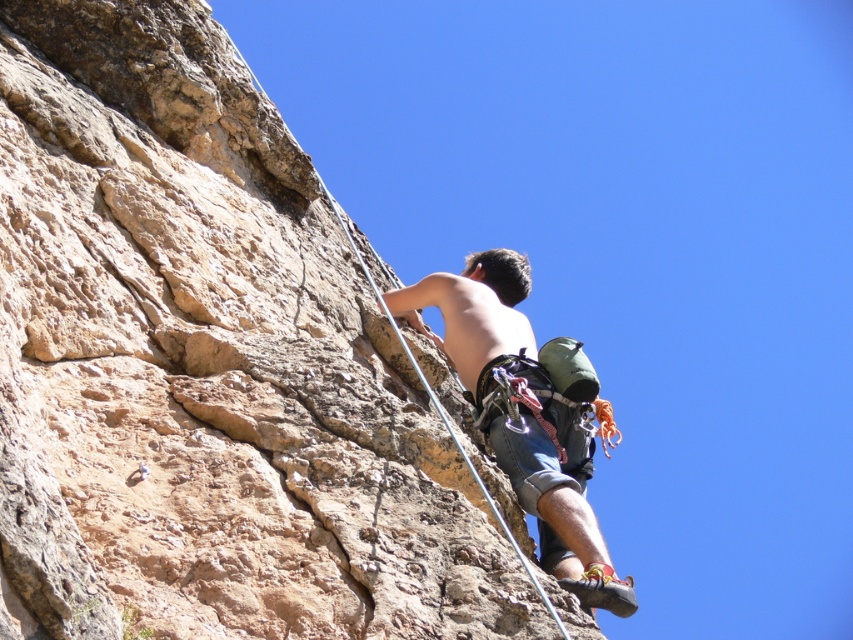
Question: Does brown rough rock at center have a larger size compared to shiny blue shorts at center?

Choices:
 (A) no
 (B) yes

Answer: (B)

Question: Which of the following is the farthest from the observer?

Choices:
 (A) brown rough rock at center
 (B) shiny blue shorts at center

Answer: (B)

Question: Can you confirm if brown rough rock at center is positioned below shiny blue shorts at center?

Choices:
 (A) no
 (B) yes

Answer: (A)

Question: Can you confirm if brown rough rock at center is smaller than shiny blue shorts at center?

Choices:
 (A) no
 (B) yes

Answer: (A)